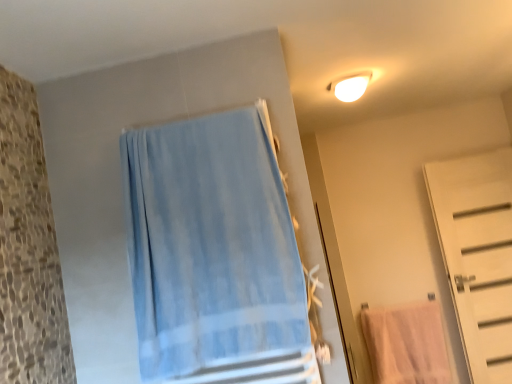
What is the approximate height of white matte door at right?

The height of white matte door at right is 1.79 meters.

This screenshot has height=384, width=512. In order to click on light blue fabric towel at center in this screenshot , I will do `click(214, 254)`.

The image size is (512, 384). Find the location of `white matte door at right`. white matte door at right is located at coordinates (477, 255).

Consider the image. Which is nearer, (508, 308) or (407, 363)?

Clearly, point (508, 308) is closer to the camera than point (407, 363).

Looking at this image, considering the positions of objects white matte door at right and pink cotton towel at lower right in the image provided, who is more to the right, white matte door at right or pink cotton towel at lower right?

Positioned to the right is white matte door at right.

From the picture: Is white matte door at right in contact with pink cotton towel at lower right?

They are not placed beside each other.

From a real-world perspective, is white matte door at right on pink cotton towel at lower right?

Yes, from a real-world perspective, white matte door at right is on top of pink cotton towel at lower right.

Considering the sizes of white glossy light fixture at upper right and light blue fabric towel at center in the image, is white glossy light fixture at upper right wider or thinner than light blue fabric towel at center?

Clearly, white glossy light fixture at upper right has more width compared to light blue fabric towel at center.

Looking at this image, from the image's perspective, is white glossy light fixture at upper right on light blue fabric towel at center?

Yes, from the image's perspective, white glossy light fixture at upper right is over light blue fabric towel at center.

Between white glossy light fixture at upper right and light blue fabric towel at center, which one is positioned behind?

Positioned behind is white glossy light fixture at upper right.

Who is shorter, white glossy light fixture at upper right or light blue fabric towel at center?

white glossy light fixture at upper right is shorter.

Is light blue fabric towel at center facing away from pink cotton towel at lower right?

No.

At what (x,y) coordinates should I click in order to perform the action: click on curtain above the pink cotton towel at lower right (from a real-world perspective). Please return your answer as a coordinate pair (x, y). This screenshot has height=384, width=512. Looking at the image, I should click on (214, 254).

Is light blue fabric towel at center with pink cotton towel at lower right?

light blue fabric towel at center and pink cotton towel at lower right are clearly separated.

Does light blue fabric towel at center contain pink cotton towel at lower right?

Definitely not — pink cotton towel at lower right is not inside light blue fabric towel at center.

From the image's perspective, is pink cotton towel at lower right above white glossy light fixture at upper right?

Incorrect, from the image's perspective, pink cotton towel at lower right is lower than white glossy light fixture at upper right.

Who is more distant, pink cotton towel at lower right or white glossy light fixture at upper right?

pink cotton towel at lower right.

Between pink cotton towel at lower right and white glossy light fixture at upper right, which one appears on the right side from the viewer's perspective?

pink cotton towel at lower right is more to the right.

From a real-world perspective, which is physically below, pink cotton towel at lower right or white matte door at right?

From a 3D spatial view, pink cotton towel at lower right is below.

Based on the photo, can you confirm if pink cotton towel at lower right is wider than white matte door at right?

Incorrect, the width of pink cotton towel at lower right does not surpass that of white matte door at right.

Could you tell me if pink cotton towel at lower right is facing white matte door at right?

No, pink cotton towel at lower right is not oriented towards white matte door at right.

Which object is more forward, pink cotton towel at lower right or white matte door at right?

white matte door at right is in front.

From the image's perspective, is white glossy light fixture at upper right beneath white matte door at right?

Incorrect, from the image's perspective, white glossy light fixture at upper right is higher than white matte door at right.

Is white glossy light fixture at upper right positioned with its back to white matte door at right?

No.

From a real-world perspective, is white glossy light fixture at upper right physically below white matte door at right?

No.

Can you confirm if white glossy light fixture at upper right is wider than white matte door at right?

Indeed, white glossy light fixture at upper right has a greater width compared to white matte door at right.

Which point is more distant from viewer, [225,285] or [500,175]?

The point [500,175] is farther.

How distant is light blue fabric towel at center from white matte door at right?

A distance of 2.46 meters exists between light blue fabric towel at center and white matte door at right.

Which object is thinner, light blue fabric towel at center or white matte door at right?

white matte door at right is thinner.

Locate an element on the screen. This screenshot has height=384, width=512. door that appears above the pink cotton towel at lower right (from the image's perspective) is located at coordinates (x=477, y=255).

Where is `curtain in front of the white glossy light fixture at upper right`? Image resolution: width=512 pixels, height=384 pixels. curtain in front of the white glossy light fixture at upper right is located at coordinates (214, 254).

From the image, which object appears to be nearer to white glossy light fixture at upper right, white matte door at right or light blue fabric towel at center?

Among the two, light blue fabric towel at center is located nearer to white glossy light fixture at upper right.

Looking at the image, which one is located closer to light blue fabric towel at center, pink cotton towel at lower right or white glossy light fixture at upper right?

white glossy light fixture at upper right.

Based on their spatial positions, is pink cotton towel at lower right or light blue fabric towel at center further from white glossy light fixture at upper right?

Among the two, pink cotton towel at lower right is located further to white glossy light fixture at upper right.

In the scene shown: Which object lies nearer to the anchor point white glossy light fixture at upper right, pink cotton towel at lower right or white matte door at right?

A: white matte door at right lies closer to white glossy light fixture at upper right than the other object.

From the image, which object appears to be nearer to light blue fabric towel at center, white glossy light fixture at upper right or pink cotton towel at lower right?

The object closer to light blue fabric towel at center is white glossy light fixture at upper right.

Considering their positions, is white glossy light fixture at upper right positioned closer to pink cotton towel at lower right than light blue fabric towel at center?

Based on the image, white glossy light fixture at upper right appears to be nearer to pink cotton towel at lower right.

When comparing their distances from light blue fabric towel at center, does white matte door at right or white glossy light fixture at upper right seem closer?

Among the two, white glossy light fixture at upper right is located nearer to light blue fabric towel at center.

Looking at the image, which one is located closer to white glossy light fixture at upper right, light blue fabric towel at center or white matte door at right?

light blue fabric towel at center is positioned closer to the anchor white glossy light fixture at upper right.

Where is `light fixture between light blue fabric towel at center and white matte door at right from left to right`? light fixture between light blue fabric towel at center and white matte door at right from left to right is located at coordinates (350, 86).

This screenshot has width=512, height=384. I want to click on light fixture located between light blue fabric towel at center and pink cotton towel at lower right in the depth direction, so click(350, 86).

Locate an element on the screen. door between light blue fabric towel at center and pink cotton towel at lower right from front to back is located at coordinates (477, 255).

Where is `door between white glossy light fixture at upper right and pink cotton towel at lower right in the vertical direction`? This screenshot has width=512, height=384. door between white glossy light fixture at upper right and pink cotton towel at lower right in the vertical direction is located at coordinates (477, 255).